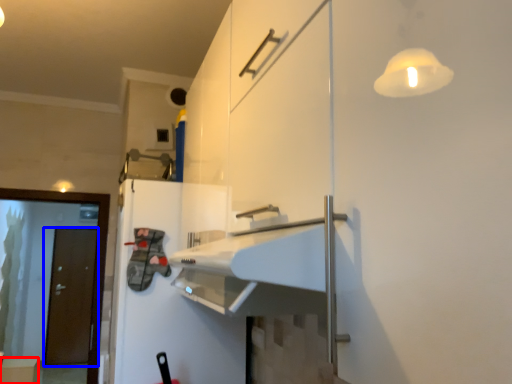
Question: Which object appears closest to the camera in this image, cabinetry (highlighted by a red box) or door (highlighted by a blue box)?

Choices:
 (A) cabinetry
 (B) door

Answer: (A)